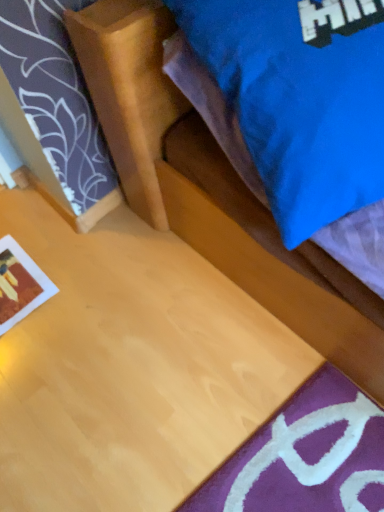
Question: Is matte blue pillow at upper right aimed at matte paper print at lower left?

Choices:
 (A) yes
 (B) no

Answer: (B)

Question: Is matte blue pillow at upper right at the left side of matte paper print at lower left?

Choices:
 (A) yes
 (B) no

Answer: (B)

Question: Does matte blue pillow at upper right have a smaller size compared to matte paper print at lower left?

Choices:
 (A) no
 (B) yes

Answer: (A)

Question: Is matte blue pillow at upper right beside matte paper print at lower left?

Choices:
 (A) no
 (B) yes

Answer: (A)

Question: From a real-world perspective, is matte blue pillow at upper right positioned over matte paper print at lower left based on gravity?

Choices:
 (A) no
 (B) yes

Answer: (B)

Question: Is matte paper print at lower left located within matte blue pillow at upper right?

Choices:
 (A) yes
 (B) no

Answer: (B)

Question: Does matte paper print at lower left have a lesser height compared to matte blue pillow at upper right?

Choices:
 (A) yes
 (B) no

Answer: (A)

Question: Does matte paper print at lower left have a lesser width compared to matte blue pillow at upper right?

Choices:
 (A) yes
 (B) no

Answer: (A)

Question: Is matte paper print at lower left next to matte blue pillow at upper right and touching it?

Choices:
 (A) no
 (B) yes

Answer: (A)

Question: From a real-world perspective, does matte paper print at lower left stand above matte blue pillow at upper right?

Choices:
 (A) no
 (B) yes

Answer: (A)

Question: Can you confirm if matte paper print at lower left is positioned to the right of matte blue pillow at upper right?

Choices:
 (A) no
 (B) yes

Answer: (A)

Question: From the image's perspective, does matte paper print at lower left appear lower than matte blue pillow at upper right?

Choices:
 (A) no
 (B) yes

Answer: (B)

Question: Is matte paper print at lower left spatially inside matte blue pillow at upper right, or outside of it?

Choices:
 (A) inside
 (B) outside

Answer: (B)